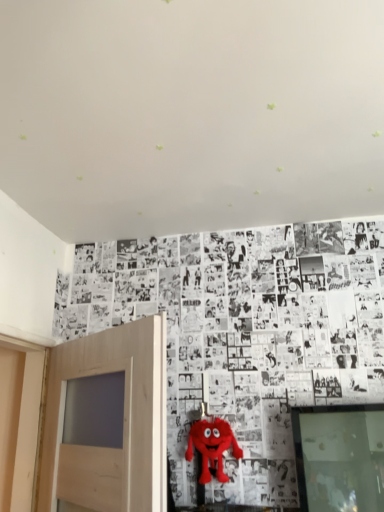
Image resolution: width=384 pixels, height=512 pixels. What do you see at coordinates (212, 447) in the screenshot?
I see `fluffy red plush at lower center` at bounding box center [212, 447].

In order to click on fluffy red plush at lower center in this screenshot , I will do `click(212, 447)`.

This screenshot has width=384, height=512. I want to click on fluffy red plush at lower center, so click(x=212, y=447).